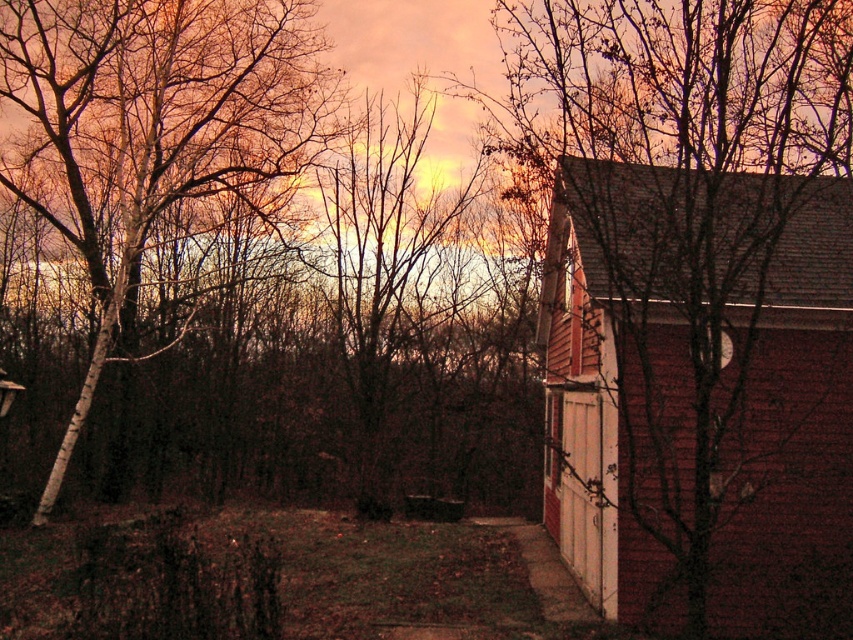
Question: Among these points, which one is farthest from the camera?

Choices:
 (A) (196, 44)
 (B) (672, 476)

Answer: (A)

Question: Considering the relative positions of brick siding house at right and smooth white tree at left in the image provided, where is brick siding house at right located with respect to smooth white tree at left?

Choices:
 (A) left
 (B) right

Answer: (B)

Question: Where is brick siding house at right located in relation to smooth white tree at left in the image?

Choices:
 (A) below
 (B) above

Answer: (A)

Question: Is brick siding house at right thinner than smooth white tree at left?

Choices:
 (A) yes
 (B) no

Answer: (A)

Question: Among these objects, which one is farthest from the camera?

Choices:
 (A) brick siding house at right
 (B) smooth white tree at left

Answer: (B)

Question: Which of the following is the closest to the observer?

Choices:
 (A) (315, 56)
 (B) (846, 476)

Answer: (B)